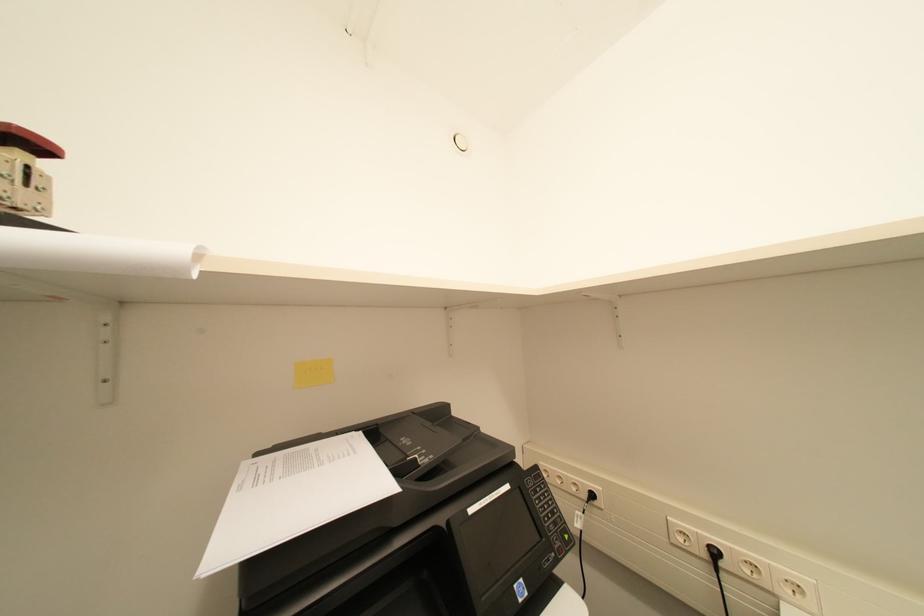
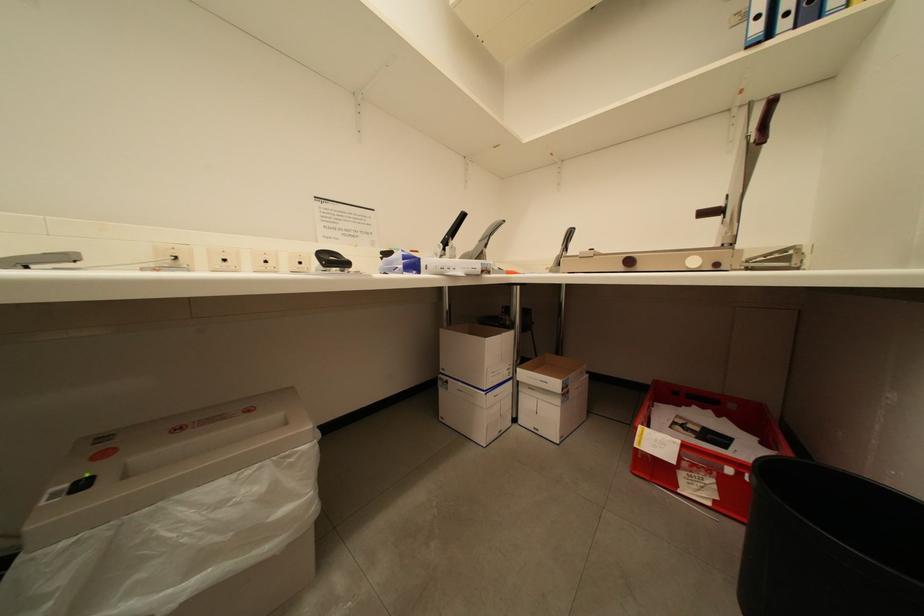
Question: The camera is either moving clockwise (left) or counter-clockwise (right) around the object. The first image is from the beginning of the video and the second image is from the end. Is the camera moving left or right when shooting the video?

Choices:
 (A) Left
 (B) Right

Answer: (A)